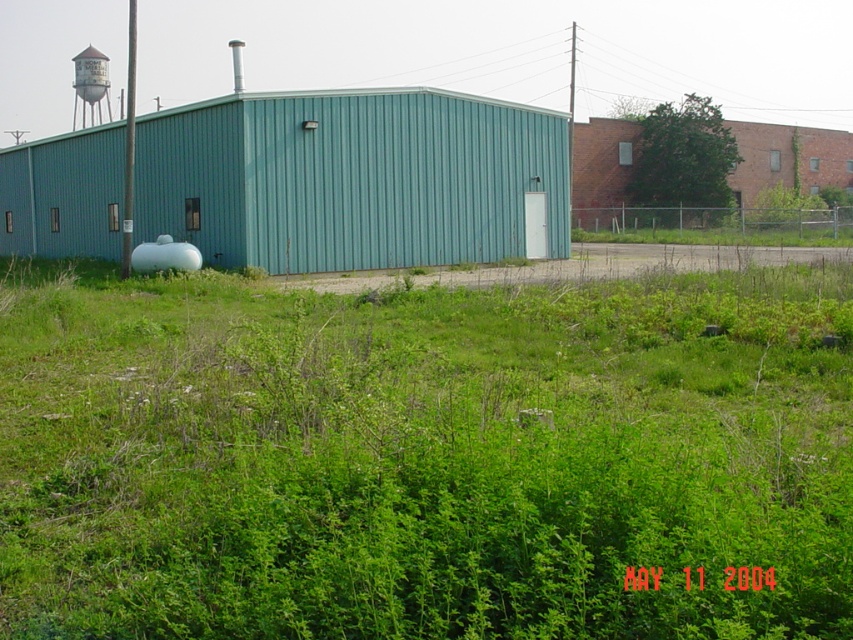
Between teal corrugated metal shed at center and white matte water tank at center-left, which one appears on the right side from the viewer's perspective?

white matte water tank at center-left

Is teal corrugated metal shed at center positioned at the back of white matte water tank at center-left?

Yes, teal corrugated metal shed at center is further from the viewer.

Identify the location of teal corrugated metal shed at center. The height and width of the screenshot is (640, 853). (354, 179).

Which is in front, point (445, 180) or point (74, 122)?

Positioned in front is point (445, 180).

Who is shorter, teal corrugated metal shed at center or white painted metal water tower at upper left?

With less height is teal corrugated metal shed at center.

The width and height of the screenshot is (853, 640). In order to click on teal corrugated metal shed at center in this screenshot , I will do `click(354, 179)`.

Locate an element on the screen. teal corrugated metal shed at center is located at coordinates (354, 179).

Can you confirm if green leafy grass at center is positioned to the right of teal corrugated metal shed at center?

Yes, green leafy grass at center is to the right of teal corrugated metal shed at center.

Can you confirm if green leafy grass at center is taller than teal corrugated metal shed at center?

In fact, green leafy grass at center may be shorter than teal corrugated metal shed at center.

Describe the element at coordinates (425, 458) in the screenshot. I see `green leafy grass at center` at that location.

At what (x,y) coordinates should I click in order to perform the action: click on green leafy grass at center. Please return your answer as a coordinate pair (x, y). The width and height of the screenshot is (853, 640). Looking at the image, I should click on (425, 458).